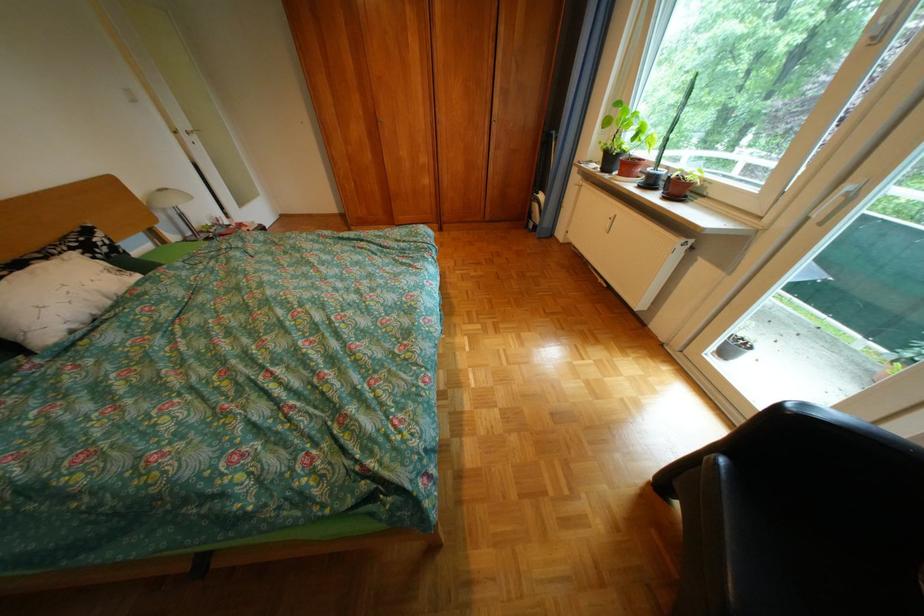
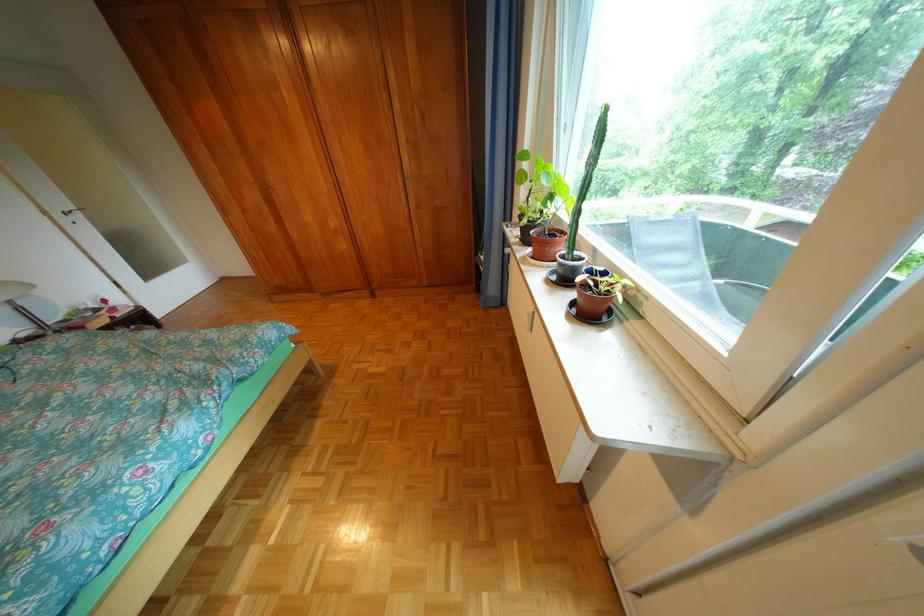
In the second image, find the point that corresponds to point 199,134 in the first image.

(73, 216)